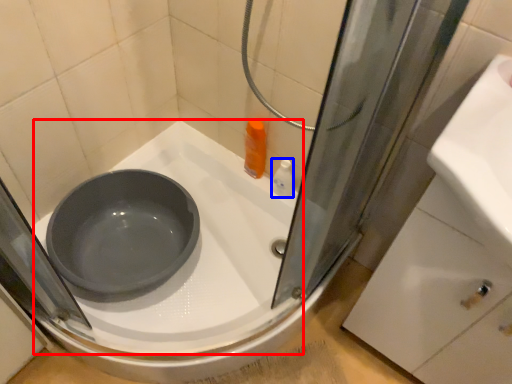
Question: Which object appears closest to the camera in this image, bath (highlighted by a red box) or toiletry (highlighted by a blue box)?

Choices:
 (A) bath
 (B) toiletry

Answer: (A)